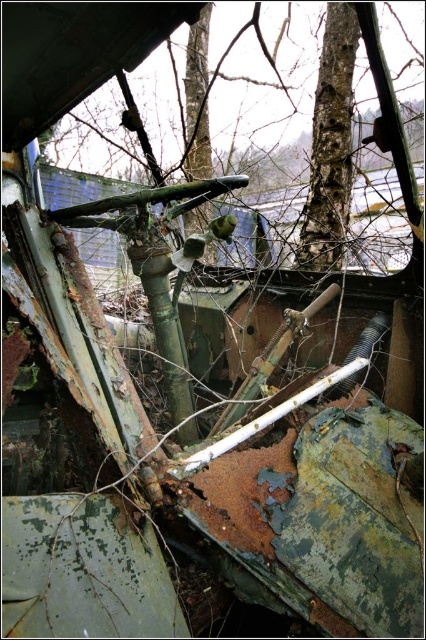
Looking at this image, is green camouflage tree at center positioned at the back of rough bark tree at upper center?

That is True.

Which is in front, point (219, 17) or point (317, 196)?

Point (317, 196) is in front.

The image size is (426, 640). I want to click on green camouflage tree at center, so pyautogui.click(x=267, y=88).